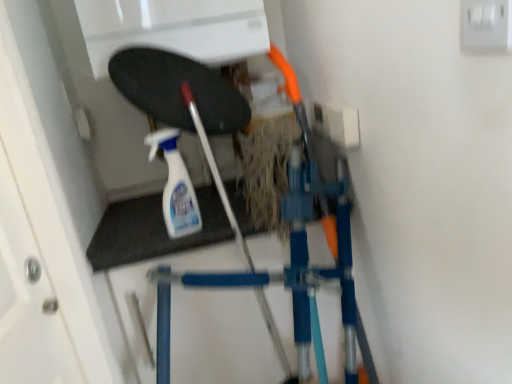
Question: From the image's perspective, is clear plastic spray bottle at center under white plastic switch at upper right?

Choices:
 (A) no
 (B) yes

Answer: (B)

Question: Considering the relative sizes of clear plastic spray bottle at center and white plastic switch at upper right in the image provided, is clear plastic spray bottle at center shorter than white plastic switch at upper right?

Choices:
 (A) no
 (B) yes

Answer: (A)

Question: Is clear plastic spray bottle at center not inside white plastic switch at upper right?

Choices:
 (A) yes
 (B) no

Answer: (A)

Question: Is clear plastic spray bottle at center bigger than white plastic switch at upper right?

Choices:
 (A) no
 (B) yes

Answer: (B)

Question: Would you say white plastic switch at upper right is part of clear plastic spray bottle at center's contents?

Choices:
 (A) no
 (B) yes

Answer: (A)

Question: Is clear plastic spray bottle at center facing towards white plastic switch at upper right?

Choices:
 (A) yes
 (B) no

Answer: (B)

Question: Is white plastic switch at upper right behind clear plastic spray bottle at center?

Choices:
 (A) yes
 (B) no

Answer: (B)

Question: Does white plastic switch at upper right have a lesser width compared to clear plastic spray bottle at center?

Choices:
 (A) yes
 (B) no

Answer: (A)

Question: Can we say white plastic switch at upper right lies outside clear plastic spray bottle at center?

Choices:
 (A) no
 (B) yes

Answer: (B)

Question: From a real-world perspective, is white plastic switch at upper right positioned over clear plastic spray bottle at center based on gravity?

Choices:
 (A) no
 (B) yes

Answer: (B)

Question: Does white plastic switch at upper right appear on the right side of clear plastic spray bottle at center?

Choices:
 (A) yes
 (B) no

Answer: (A)

Question: Is white plastic switch at upper right at the left side of clear plastic spray bottle at center?

Choices:
 (A) yes
 (B) no

Answer: (B)

Question: Considering their positions, is white plastic switch at upper right located in front of or behind clear plastic spray bottle at center?

Choices:
 (A) front
 (B) behind

Answer: (A)